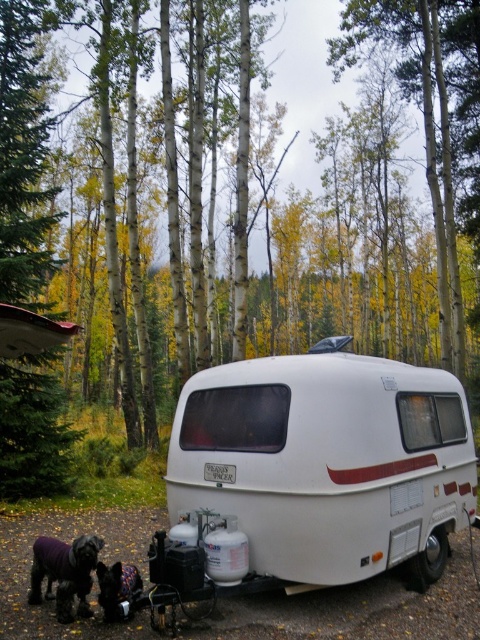
Question: Which point is closer to the camera?

Choices:
 (A) (117, 563)
 (B) (75, 556)
 (C) (409, 429)

Answer: (B)

Question: Is green leafy tree at left thinner than dark brown fur at lower left?

Choices:
 (A) no
 (B) yes

Answer: (A)

Question: Can you confirm if green leafy tree at left is smaller than dark brown fur at lower left?

Choices:
 (A) yes
 (B) no

Answer: (B)

Question: In this image, where is white matte trailer at center located relative to black fur dog at lower left?

Choices:
 (A) left
 (B) right

Answer: (B)

Question: Which of the following is the farthest from the observer?

Choices:
 (A) green leafy tree at left
 (B) white matte trailer at center
 (C) black fur dog at lower left

Answer: (A)

Question: Which point is farther to the camera?

Choices:
 (A) green leafy tree at left
 (B) black fur dog at lower left
 (C) white matte trailer at center
 (D) dark brown fur at lower left

Answer: (A)